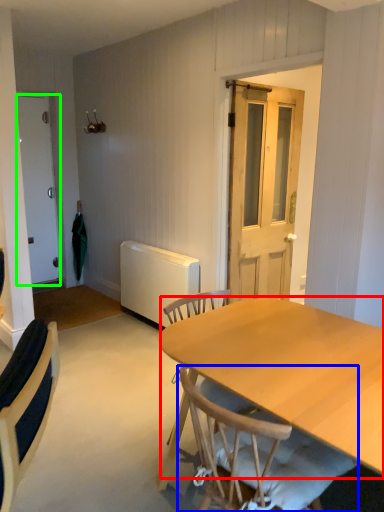
Question: Based on their relative distances, which object is nearer to tablecloth (highlighted by a red box)? Choose from chair (highlighted by a blue box) and door (highlighted by a green box).

Choices:
 (A) chair
 (B) door

Answer: (A)